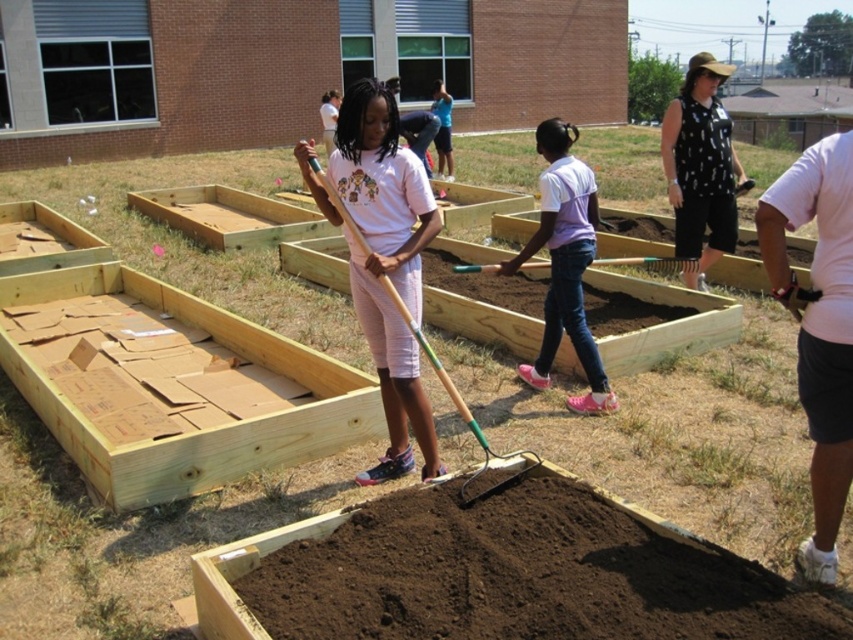
You are a photographer trying to capture a photo of the gardening scene. You want to ensure both the pink cotton shirt at right and the green wooden rake at center are visible in the frame. Which object should you position closer to the camera to ensure both are fully visible?

The pink cotton shirt at right has a lesser width compared to the green wooden rake at center. To ensure both are fully visible, position the pink cotton shirt at right closer to the camera since its smaller size requires less space in the frame compared to the larger green wooden rake at center.

You are a gardener who needs to use the wooden shovel at center and the green wooden rake at center. Which tool should you reach for first if you want to grab the one closest to you?

The wooden shovel at center is in front of the green wooden rake at center, so you should reach for the wooden shovel at center first as it is closer to you.

Looking at this image, you are a photographer trying to capture a clear shot of the pink fabric shirt at center and the green wooden rake at center. Which object should you focus on first if you want to ensure both are in focus without adjusting your camera settings?

The pink fabric shirt at center is much taller than the green wooden rake at center, so focusing on the pink fabric shirt at center first would help ensure both are in focus since it is farther away.